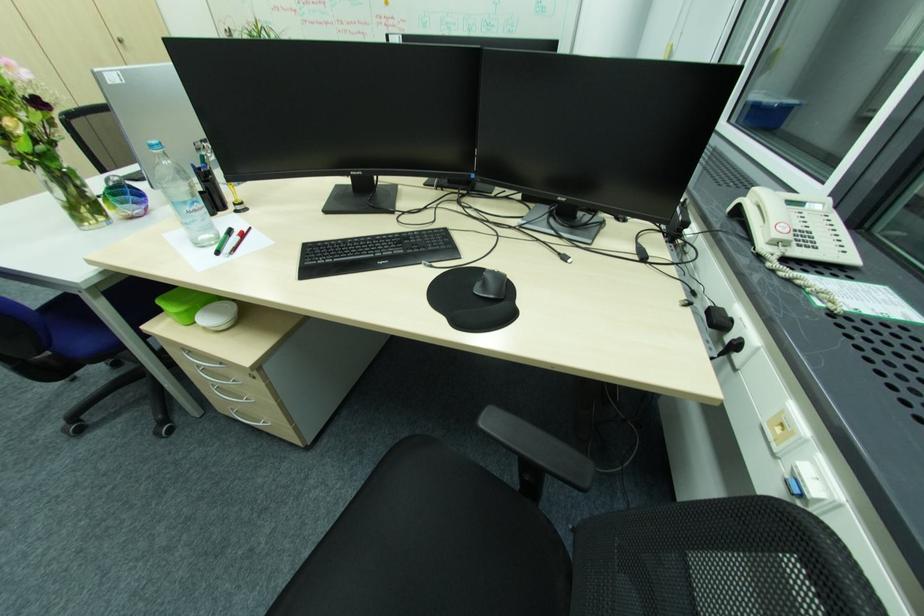
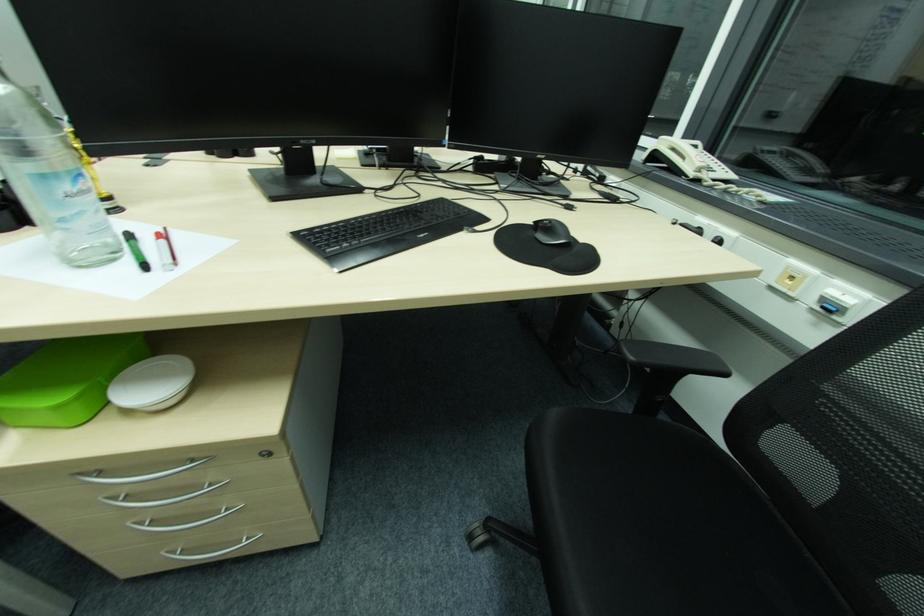
Locate, in the second image, the point that corresponds to (191,312) in the first image.

(84, 395)